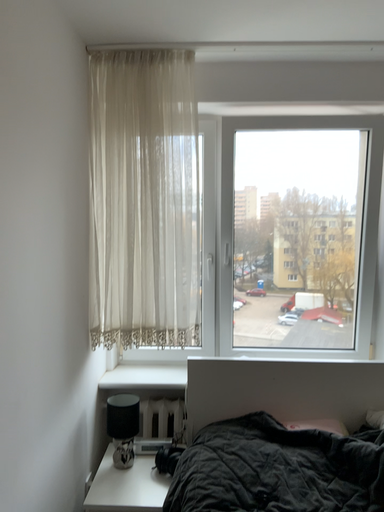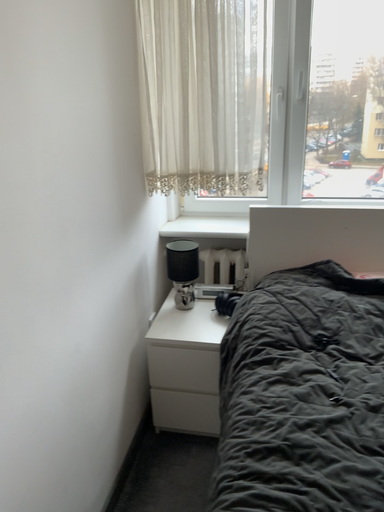
Question: Which way did the camera rotate in the video?

Choices:
 (A) rotated upward
 (B) rotated downward

Answer: (B)